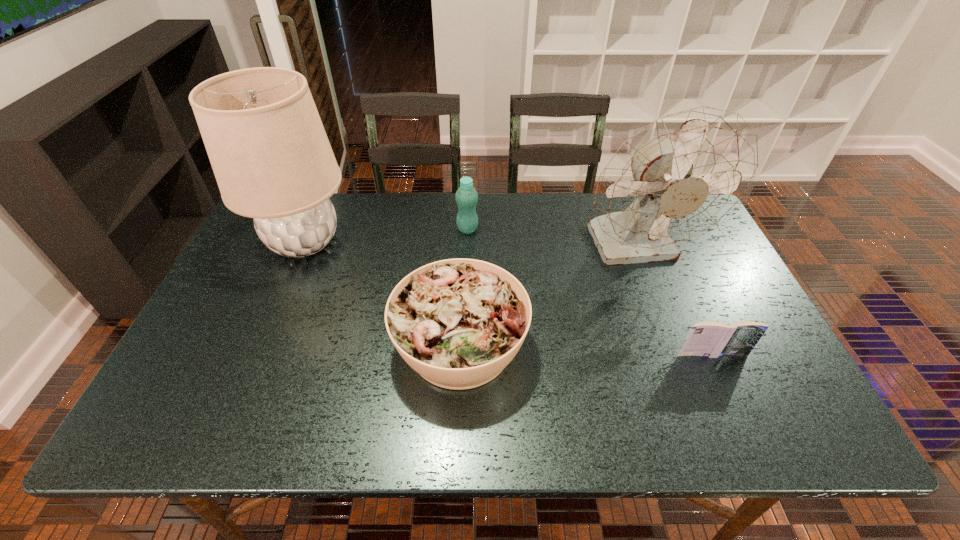
The width and height of the screenshot is (960, 540). What are the coordinates of `vacant region at the near edge of the desktop` in the screenshot? It's located at (x=611, y=407).

In the image, there is a desktop. Where is `vacant space at the left edge`? vacant space at the left edge is located at coordinates (263, 332).

In the image, there is a desktop. Where is `free space at the right edge`? Image resolution: width=960 pixels, height=540 pixels. free space at the right edge is located at coordinates (769, 357).

In the image, there is a desktop. At what (x,y) coordinates should I click in order to perform the action: click on vacant space at the near left corner. Please return your answer as a coordinate pair (x, y). Image resolution: width=960 pixels, height=540 pixels. Looking at the image, I should click on (192, 438).

Locate an element on the screen. This screenshot has width=960, height=540. vacant region between the book and the fan is located at coordinates (675, 301).

Where is `empty space between the book and the second shortest object`? This screenshot has width=960, height=540. empty space between the book and the second shortest object is located at coordinates (587, 350).

Where is `free area in between the second shortest object and the fan`? Image resolution: width=960 pixels, height=540 pixels. free area in between the second shortest object and the fan is located at coordinates (549, 296).

At what (x,y) coordinates should I click in order to perform the action: click on free space between the second shortest object and the leftmost object. Please return your answer as a coordinate pair (x, y). The width and height of the screenshot is (960, 540). Looking at the image, I should click on (382, 294).

Locate an element on the screen. Image resolution: width=960 pixels, height=540 pixels. free space that is in between the leftmost object and the salad is located at coordinates (382, 294).

This screenshot has width=960, height=540. I want to click on free spot between the water bottle and the shortest object, so click(x=589, y=292).